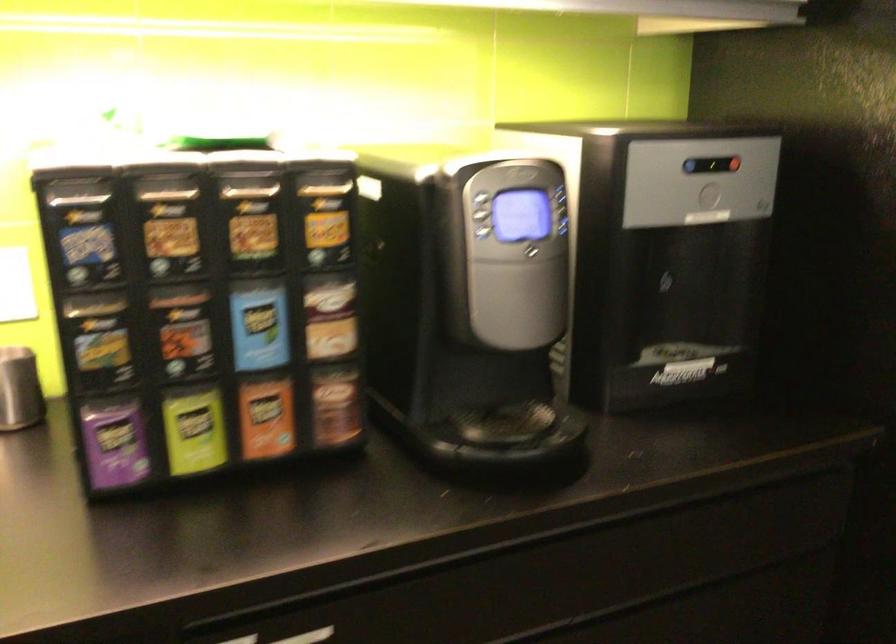
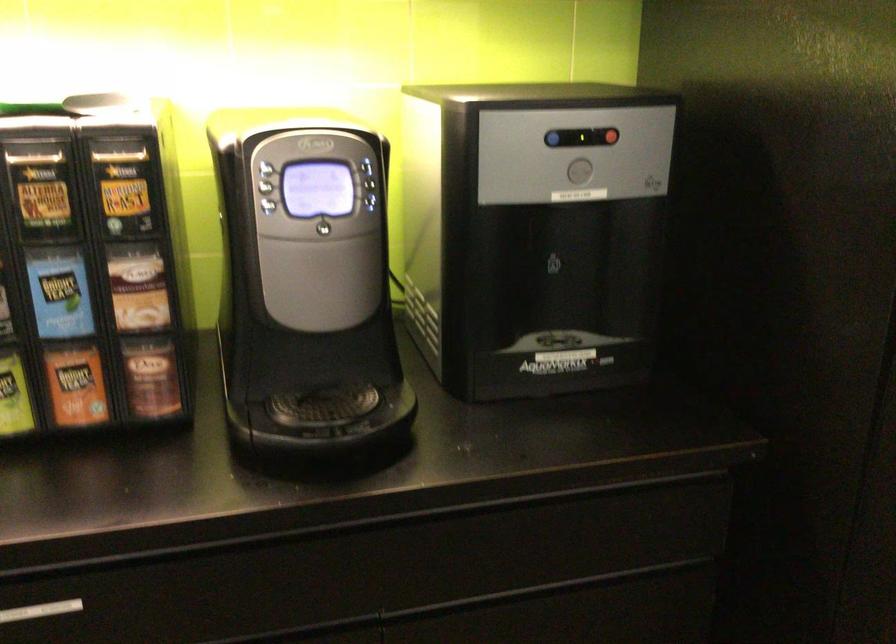
In the second image, find the point that corresponds to point (569, 228) in the first image.

(375, 204)